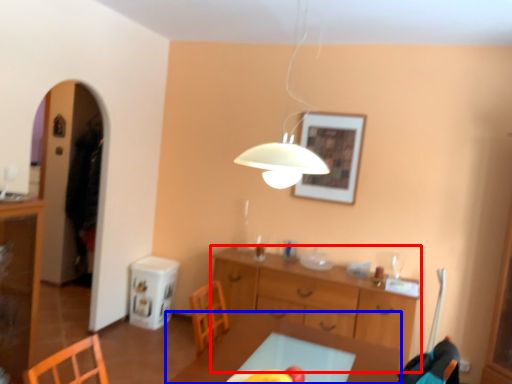
Question: Which object appears closest to the camera in this image, desk (highlighted by a red box) or table (highlighted by a blue box)?

Choices:
 (A) desk
 (B) table

Answer: (B)